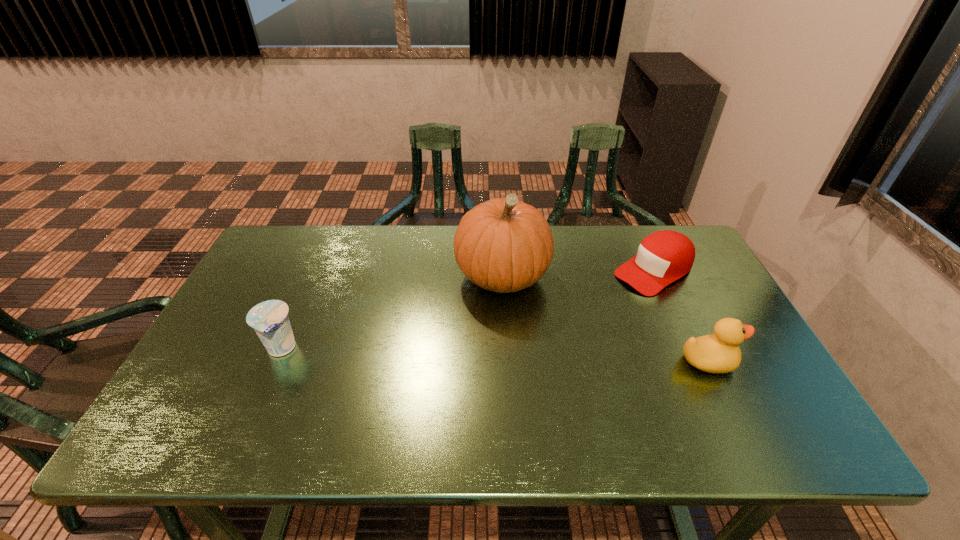
The image size is (960, 540). I want to click on free spot on the desktop that is between the leftmost object and the duck and is positioned on the stem of the pumpkin, so click(x=440, y=354).

Locate an element on the screen. The height and width of the screenshot is (540, 960). vacant spot on the desktop that is between the yogurt and the duck and is positioned on the front-facing side of the baseball cap is located at coordinates (515, 356).